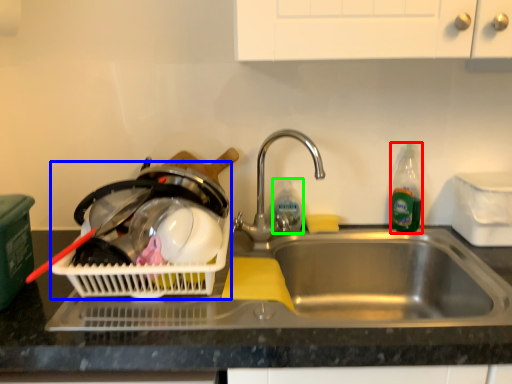
Question: Which is nearer to the bottle (highlighted by a red box)? basket container (highlighted by a blue box) or bottle (highlighted by a green box).

Choices:
 (A) basket container
 (B) bottle

Answer: (B)